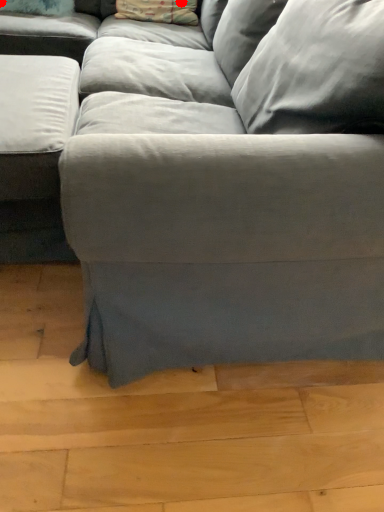
Question: Two points are circled on the image, labeled by A and B beside each circle. Which point is closer to the camera?

Choices:
 (A) A is closer
 (B) B is closer

Answer: (B)